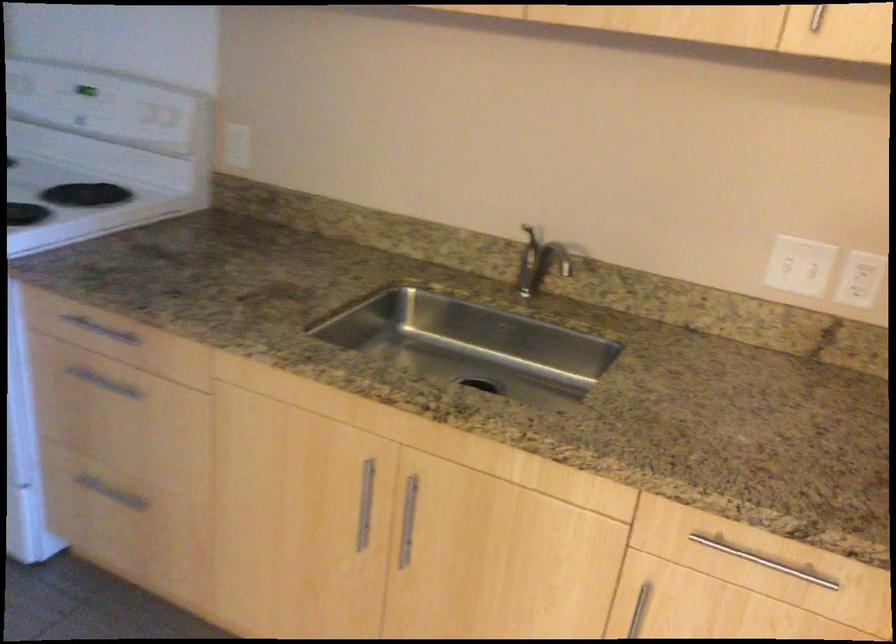
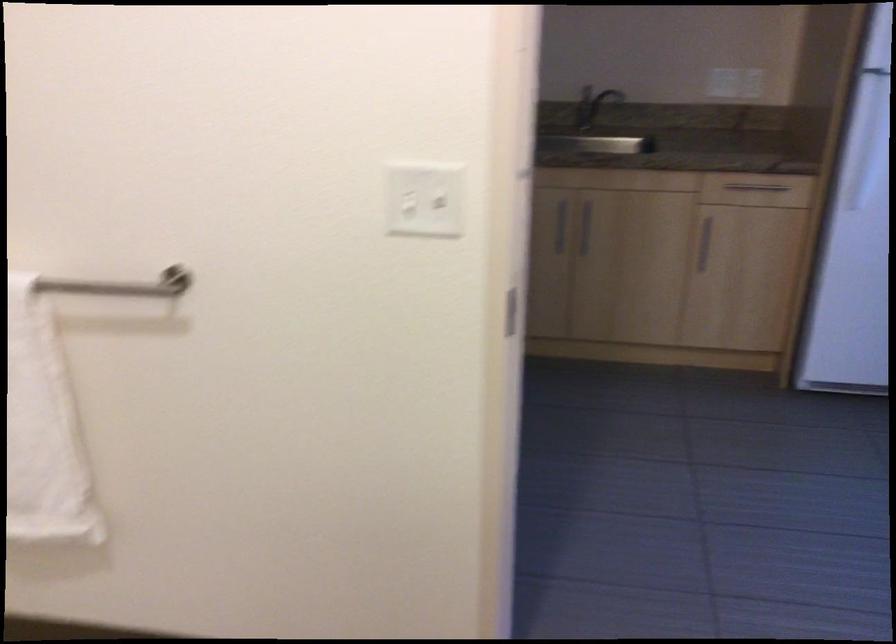
What movement of the cameraman would produce the second image?

The cameraman moved toward left, backward.